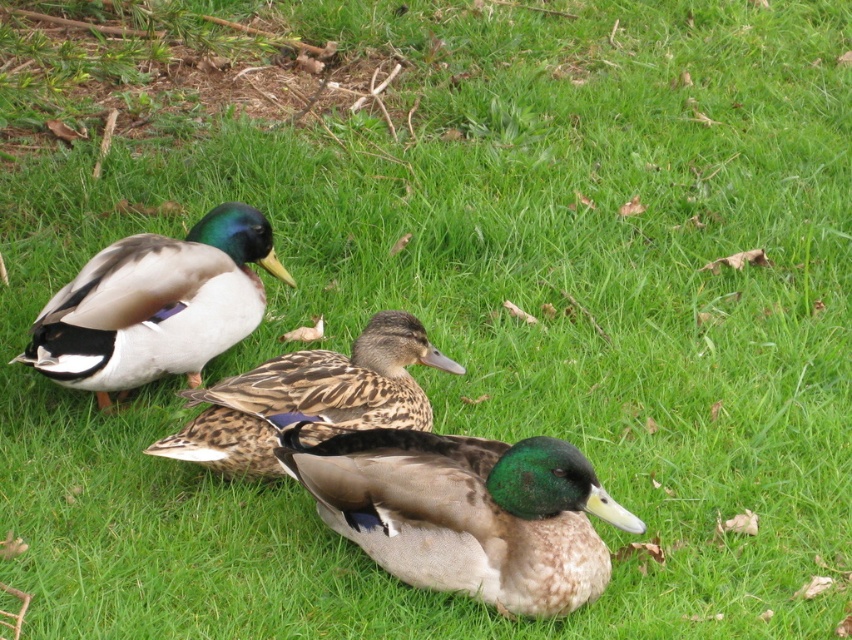
You are a wildlife photographer aiming to capture a closeup shot of the green glossy duck at center and the brown speckled duck at center. Given that your camera can only focus on objects within a 1.2 meter width, can you fit both ducks into the frame without moving the camera?

The green glossy duck at center is larger in width than the brown speckled duck at center. However, the combined width of both ducks would need to be less than 1.2 meters to fit. Since their individual widths aren

You are a birdwatcher observing the ducks in the image. You notice the green glossy duck at center and the brown speckled duck at center. Which duck is positioned to the right of the other?

The green glossy duck at center is positioned to the right of the brown speckled duck at center.